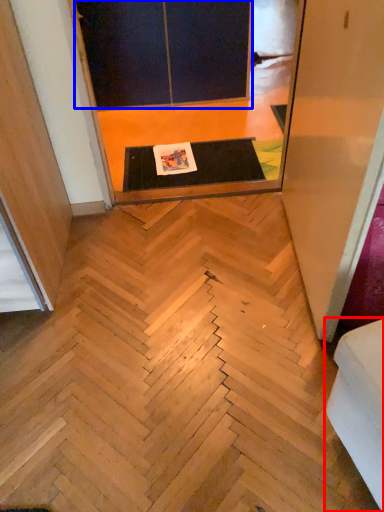
Question: Which object is closer to the camera taking this photo, furniture (highlighted by a red box) or screen door (highlighted by a blue box)?

Choices:
 (A) furniture
 (B) screen door

Answer: (A)